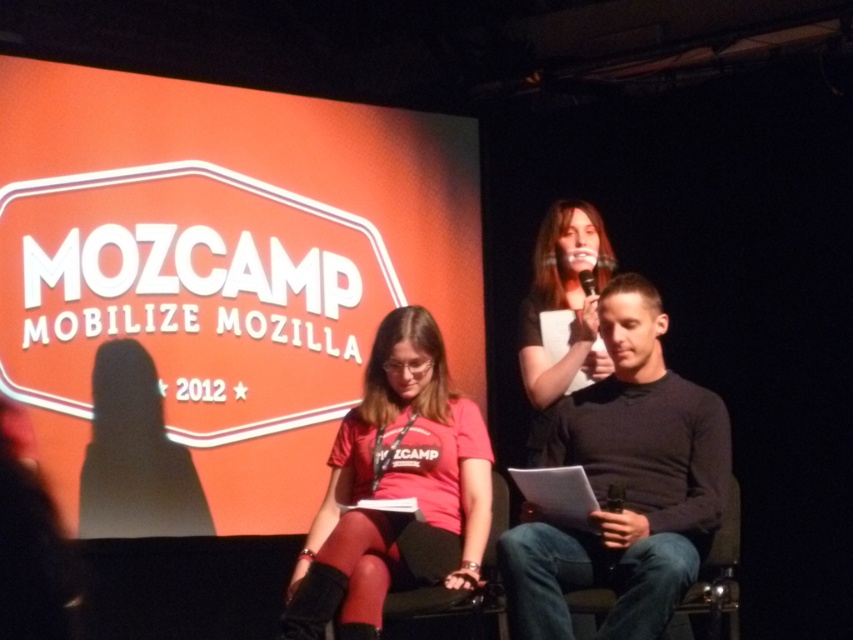
Does black matte shirt at center have a lesser height compared to denim fabric chair at center?

No, black matte shirt at center is not shorter than denim fabric chair at center.

Who is higher up, black matte shirt at center or denim fabric chair at center?

black matte shirt at center is higher up.

Is point (618, 570) positioned behind point (734, 637)?

No, (618, 570) is in front of (734, 637).

Image resolution: width=853 pixels, height=640 pixels. I want to click on black matte shirt at center, so click(x=624, y=484).

Does matte black microphone at upper center have a lesser height compared to denim fabric chair at center?

No, matte black microphone at upper center is not shorter than denim fabric chair at center.

Between matte black microphone at upper center and denim fabric chair at center, which one appears on the right side from the viewer's perspective?

From the viewer's perspective, denim fabric chair at center appears more on the right side.

Image resolution: width=853 pixels, height=640 pixels. I want to click on matte black microphone at upper center, so click(561, 308).

Who is more distant from viewer, (560, 531) or (453, 572)?

Positioned behind is point (560, 531).

Who is more forward, [660,500] or [360,596]?

Point [360,596] is in front.

Where is `black matte shirt at center`? This screenshot has height=640, width=853. black matte shirt at center is located at coordinates (624, 484).